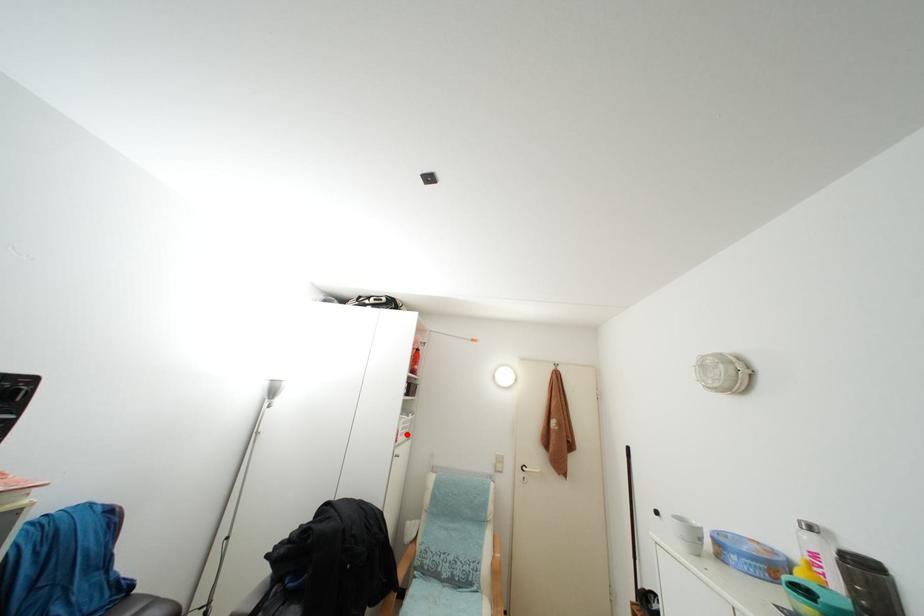
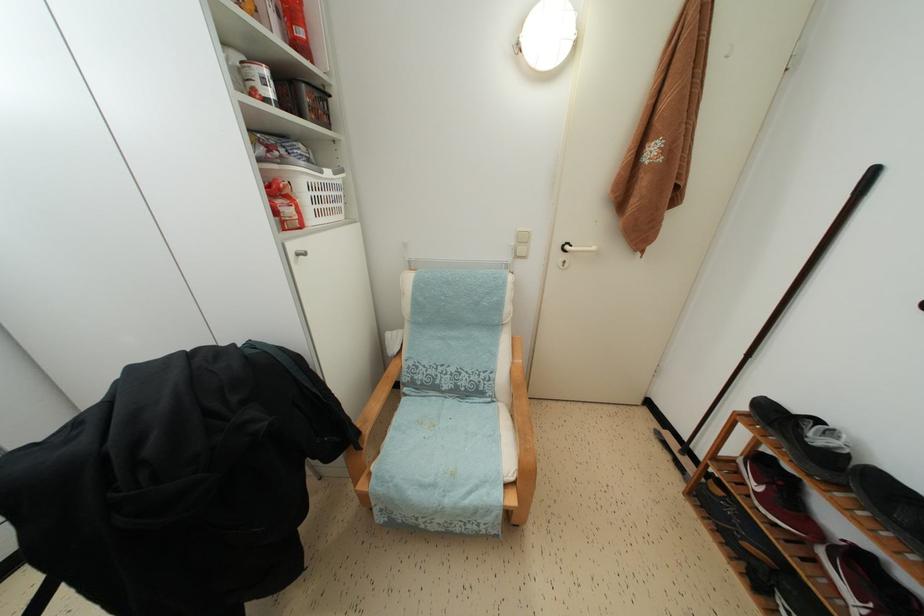
Locate, in the second image, the point that corresponds to the highlighted location in the first image.

(319, 206)